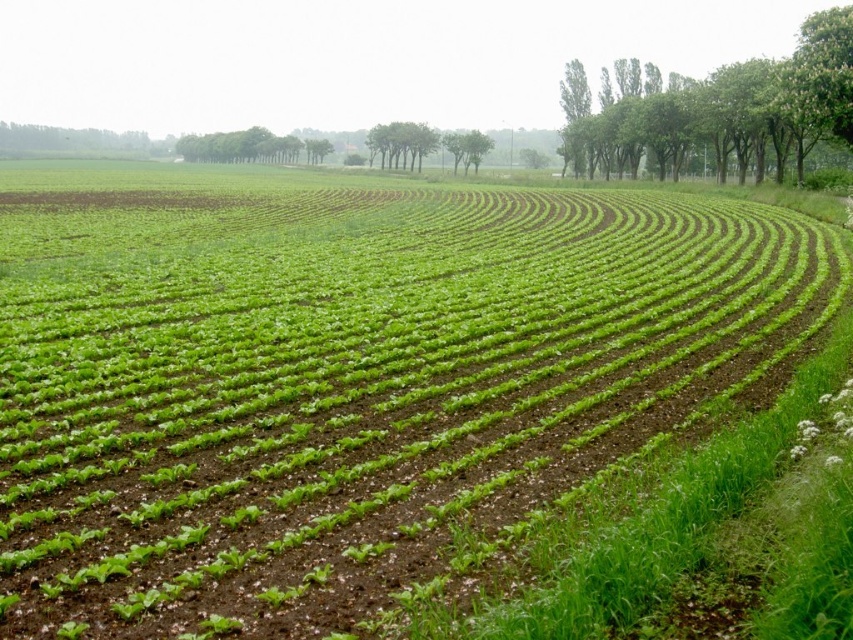
You are a farmer checking the health of your crops in the field. You notice a point in the field at coordinates [248,147]. What is located at this point?

The point at coordinates [248,147] corresponds to green leafy trees at upper center.